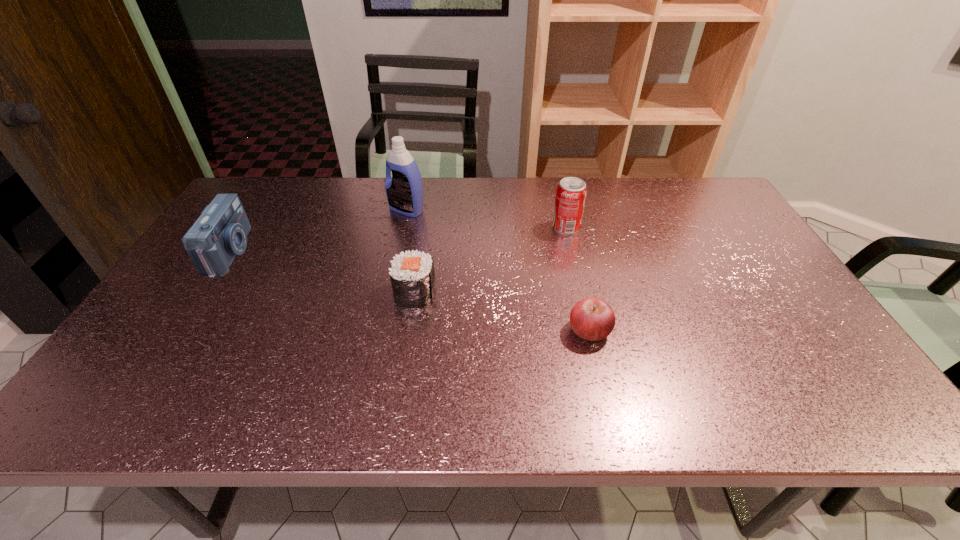
Identify the location of the farthest object. (404, 190).

The width and height of the screenshot is (960, 540). Identify the location of detergent. (404, 190).

This screenshot has width=960, height=540. Find the location of `soda can`. soda can is located at coordinates (571, 193).

Find the location of a particular element. This screenshot has width=960, height=540. camera is located at coordinates [220, 233].

Find the location of a particular element. Image resolution: width=960 pixels, height=540 pixels. the third tallest object is located at coordinates (220, 233).

Image resolution: width=960 pixels, height=540 pixels. Identify the location of sushi. (412, 275).

Where is `the nearest object`? This screenshot has width=960, height=540. the nearest object is located at coordinates (592, 319).

Where is `vacant point located 0.360m on the left of the farthest object`? This screenshot has width=960, height=540. vacant point located 0.360m on the left of the farthest object is located at coordinates (276, 210).

This screenshot has width=960, height=540. I want to click on vacant space located 0.200m on the front of the soda can, so click(x=579, y=281).

Find the location of a particular element. Image resolution: width=960 pixels, height=540 pixels. vacant area situated on the lens of the camera is located at coordinates (357, 252).